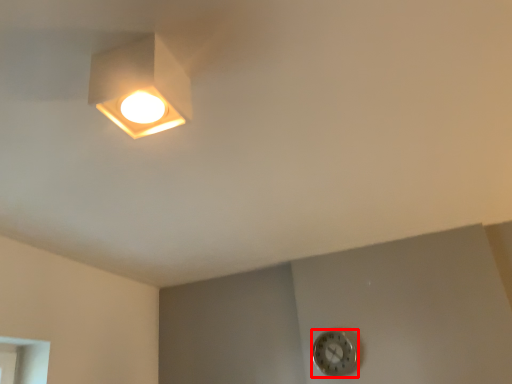
Question: From the image's perspective, where is clock (annotated by the red box) located in relation to lamp in the image?

Choices:
 (A) below
 (B) above

Answer: (A)